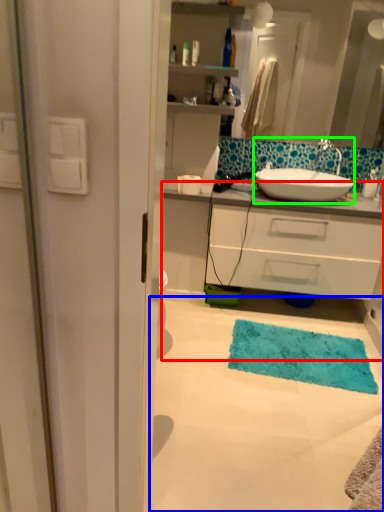
Question: Estimate the real-world distances between objects in this image. Which object is farther from bathroom cabinet (highlighted by a red box), plain (highlighted by a blue box) or sink (highlighted by a green box)?

Choices:
 (A) plain
 (B) sink

Answer: (A)